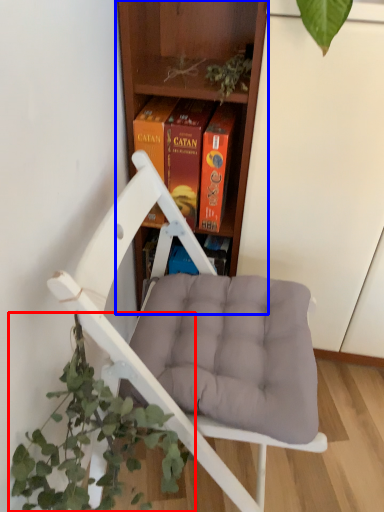
Question: Which of the following is the closest to the observer, houseplant (highlighted by a red box) or shelf (highlighted by a blue box)?

Choices:
 (A) houseplant
 (B) shelf

Answer: (A)